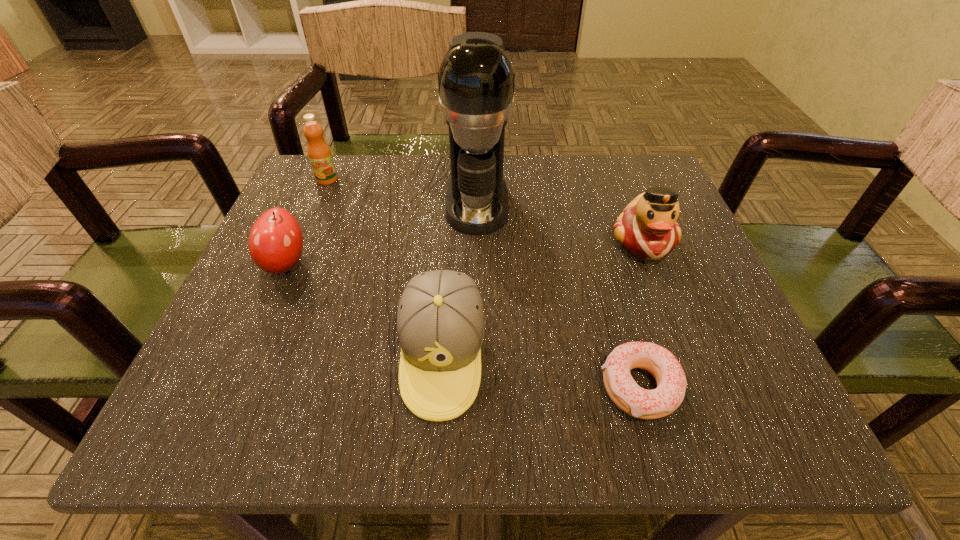
The height and width of the screenshot is (540, 960). I want to click on object that is positioned at the far left corner, so click(319, 153).

Find the location of `object positioned at the far right corner`. object positioned at the far right corner is located at coordinates (647, 229).

Image resolution: width=960 pixels, height=540 pixels. What are the coordinates of `object present at the near right corner` in the screenshot? It's located at (671, 381).

Locate an element on the screen. Image resolution: width=960 pixels, height=540 pixels. vacant space at the far edge of the desktop is located at coordinates (385, 195).

Find the location of a particular element. The height and width of the screenshot is (540, 960). vacant space at the near edge is located at coordinates (505, 422).

In the image, there is a desktop. Identify the location of free region at the right edge. (654, 271).

The width and height of the screenshot is (960, 540). In the image, there is a desktop. Find the location of `free space at the far left corner`. free space at the far left corner is located at coordinates (303, 176).

I want to click on vacant space at the far right corner of the desktop, so click(661, 180).

At what (x,y) coordinates should I click in order to perform the action: click on vacant space at the near right corner. Please return your answer as a coordinate pair (x, y). This screenshot has height=540, width=960. Looking at the image, I should click on pyautogui.click(x=772, y=430).

Locate an element on the screen. free space between the baseball cap and the orange juice is located at coordinates (385, 268).